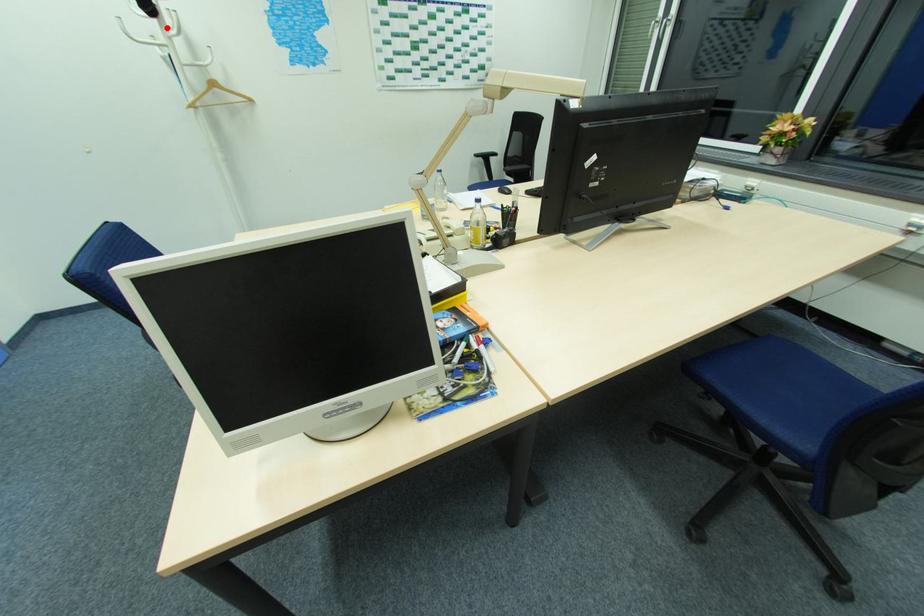
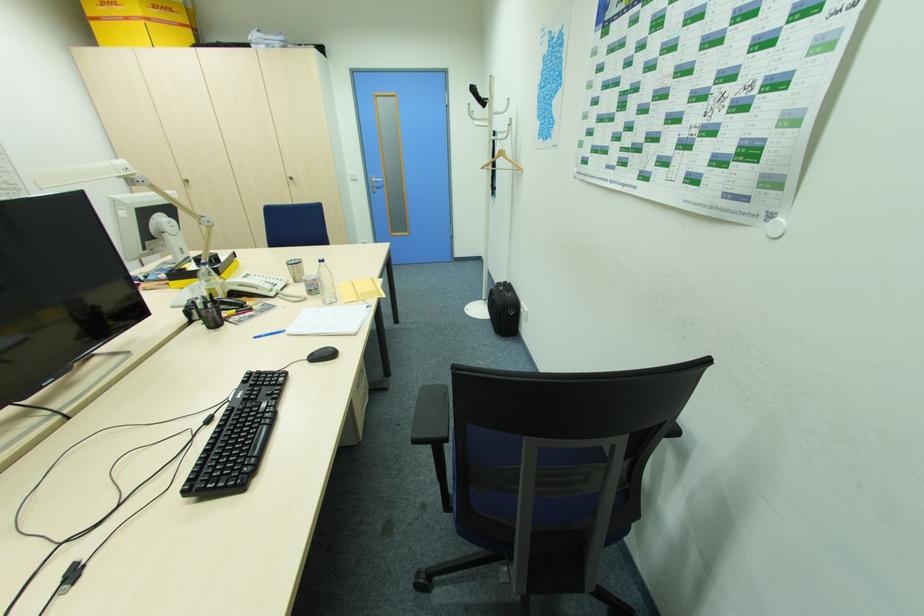
Question: A red point is marked in image1. In image2, is the corresponding 3D point closer to the camera or farther? Reply with the corresponding letter.

Choices:
 (A) The corresponding 3D point is closer.
 (B) The corresponding 3D point is farther.

Answer: (A)